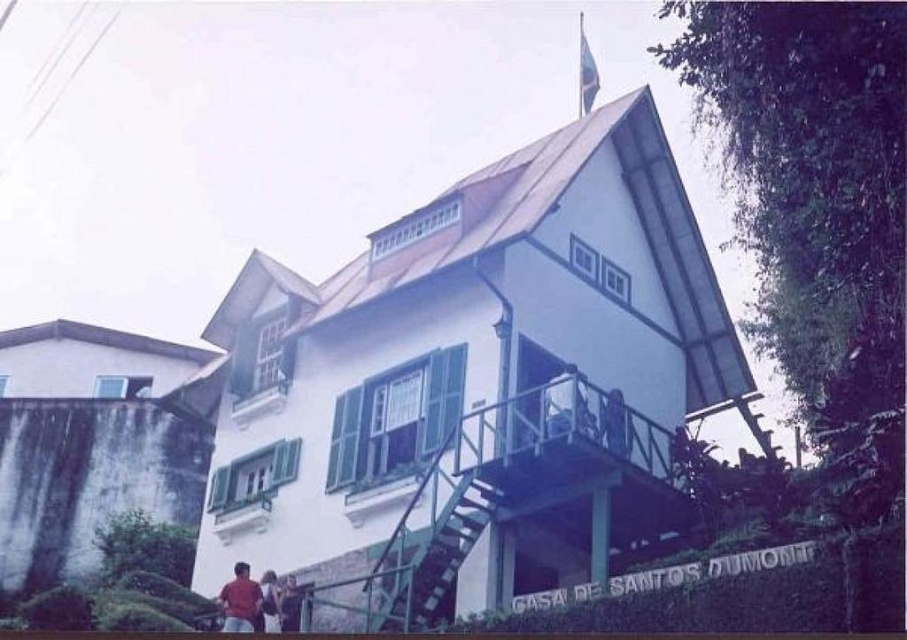
Question: Which point is closer to the camera taking this photo?

Choices:
 (A) tap(490, 490)
 (B) tap(285, 592)
 (C) tap(239, 628)
 (D) tap(260, 579)

Answer: (C)

Question: Which point appears closest to the camera in this image?

Choices:
 (A) (384, 608)
 (B) (246, 621)
 (C) (236, 476)

Answer: (A)

Question: Can you confirm if metallic staircase at center is thinner than matte red shirt at lower left?

Choices:
 (A) no
 (B) yes

Answer: (A)

Question: Does matte red shirt at lower left have a smaller size compared to red shirt at lower left?

Choices:
 (A) no
 (B) yes

Answer: (A)

Question: Is metallic staircase at center in front of white painted wood balcony at lower left?

Choices:
 (A) yes
 (B) no

Answer: (A)

Question: Which object appears closest to the camera in this image?

Choices:
 (A) matte red shirt at lower center
 (B) metallic staircase at center
 (C) matte red shirt at lower left
 (D) white painted wood balcony at lower left

Answer: (B)